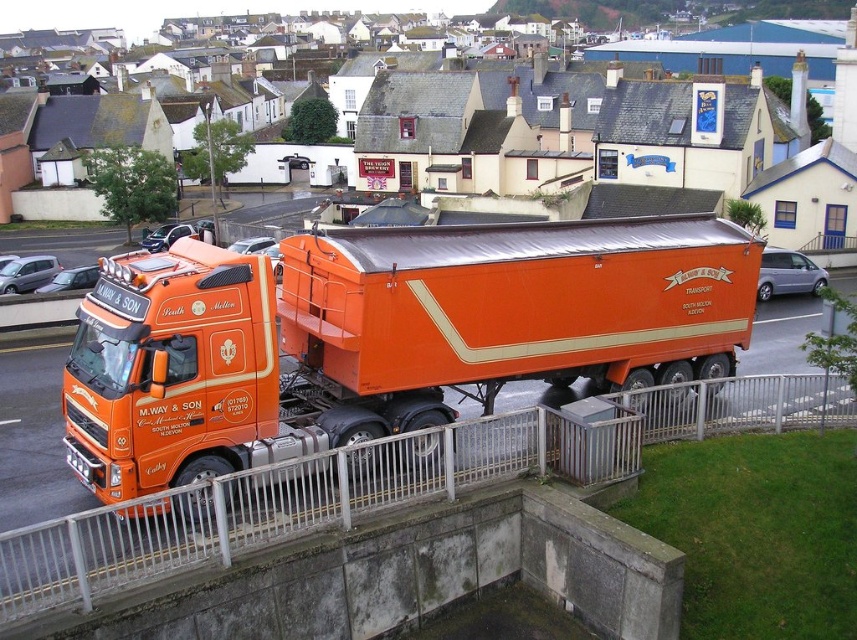
Who is more forward, (x=466, y=236) or (x=495, y=438)?

Point (x=495, y=438) is more forward.

Is orange matte trailer truck at center bigger than metallic silver rail at lower center?

Indeed, orange matte trailer truck at center has a larger size compared to metallic silver rail at lower center.

The image size is (857, 640). In order to click on orange matte trailer truck at center in this screenshot , I will do pos(382,336).

Identify the location of orange matte trailer truck at center. (382, 336).